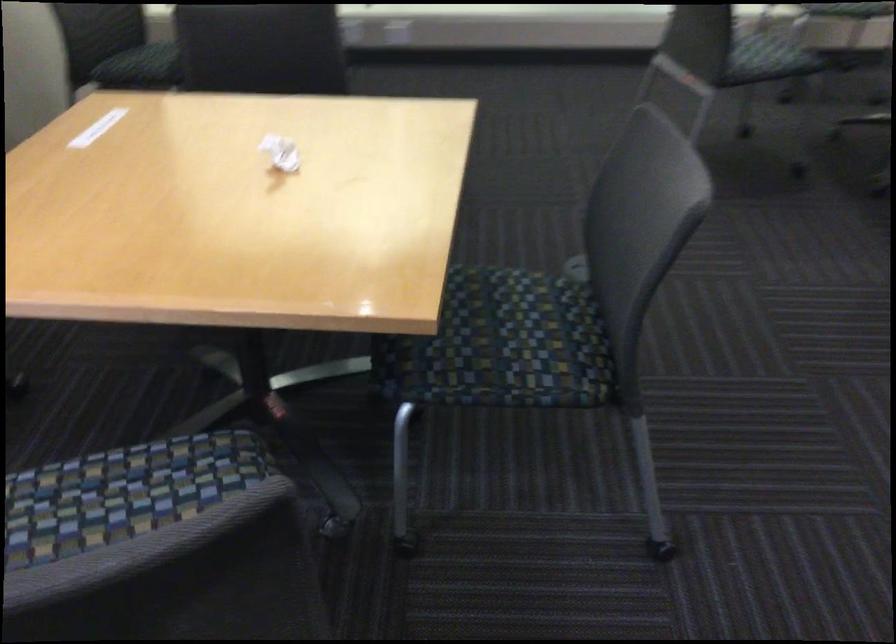
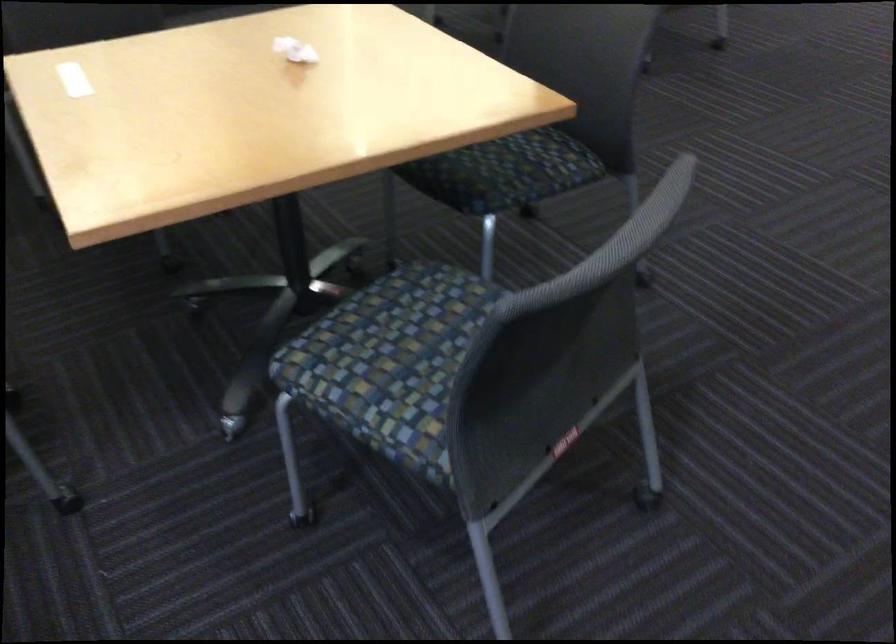
Question: The images are taken continuously from a first-person perspective. In which direction is your viewpoint rotating?

Choices:
 (A) Left
 (B) Right
 (C) Up
 (D) Down

Answer: (B)